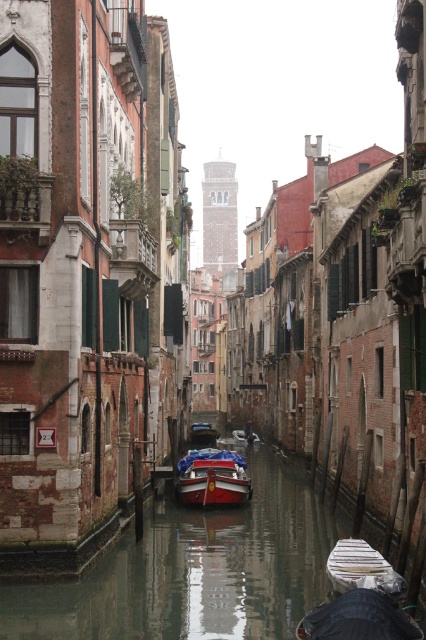
You are navigating a small boat along the canal in this scene. You notice two points marked on your map at coordinates point (69, 605) and point (334, 563). Which point is closer to you as you face the direction of the buildings along the canal?

Point (334, 563) is closer to you because point (69, 605) is behind it.

You are a delivery person who needs to place a small package on the white plastic boat at center. However, you are standing on the smooth concrete canal at center. Can you reach the boat from your current position without stepping into the water?

The smooth concrete canal at center has a greater height compared to the white plastic boat at center. Since the canal is higher, you can safely place the package on the boat without stepping into the water.

You are standing on the bank of the canal and want to walk to the wooden polished boat at center. Which direction should you move relative to the smooth concrete canal at center?

You should move towards the smooth concrete canal at center because it is in front of the wooden polished boat at center, so walking towards the canal will lead you directly to the boat.